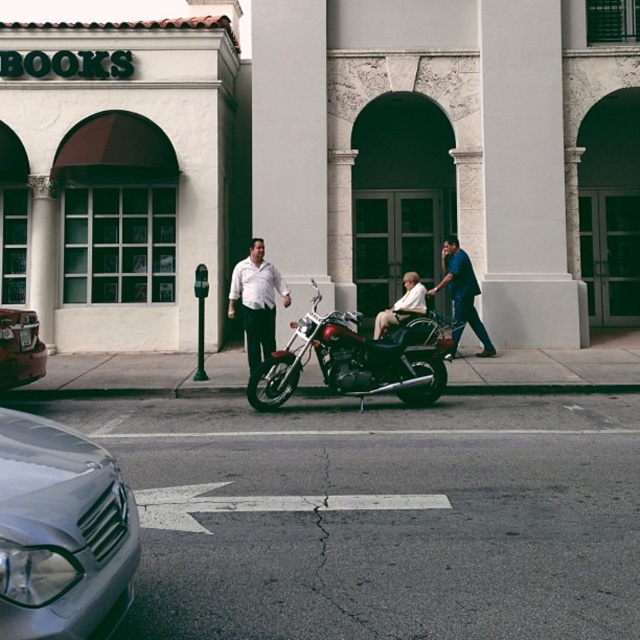
Can you confirm if white matte shirt at center is bigger than shiny silver car at lower left?

Yes.

Who is more distant from viewer, (252, 300) or (10, 371)?

The point (252, 300) is behind.

Is point (260, 284) farther from camera compared to point (28, 348)?

That is True.

Find the location of a particular element. This screenshot has width=640, height=640. white matte shirt at center is located at coordinates (257, 301).

Who is higher up, shiny chrome motorcycle at center or smooth beige wheelchair at center?

smooth beige wheelchair at center is higher up.

Locate an element on the screen. The height and width of the screenshot is (640, 640). shiny chrome motorcycle at center is located at coordinates (353, 362).

This screenshot has height=640, width=640. I want to click on shiny chrome motorcycle at center, so click(x=353, y=362).

Between point (54, 588) and point (378, 321), which one is positioned in front?

Point (54, 588)

Is point (125, 557) farther from viewer compared to point (408, 285)?

No.

I want to click on silver metallic car at lower left, so click(61, 532).